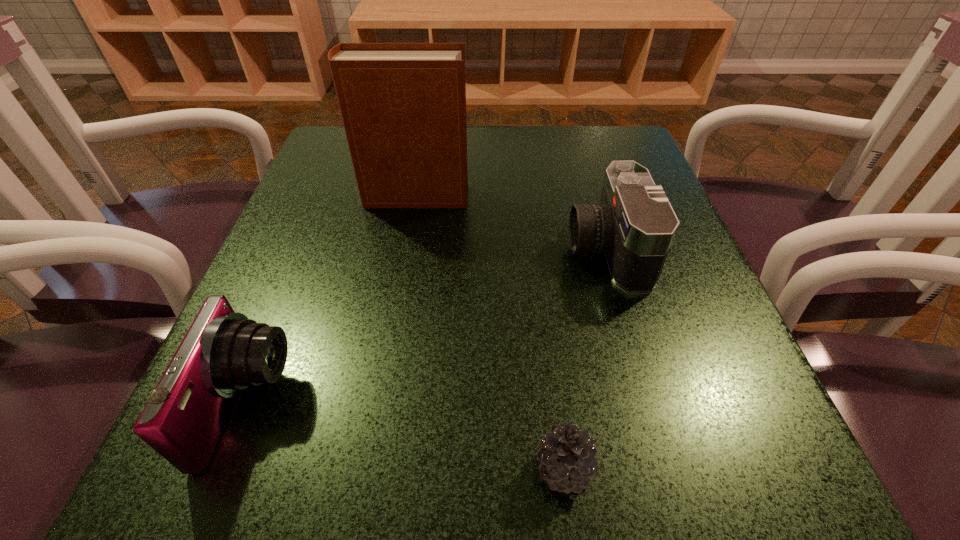
This screenshot has height=540, width=960. I want to click on free space located on the front-facing side of the right camera, so click(x=404, y=249).

Locate an element on the screen. free spot located 0.140m on the front-facing side of the right camera is located at coordinates pos(490,249).

I want to click on free spot located 0.260m on the front-facing side of the leftmost object, so click(483, 404).

I want to click on vacant space located 0.320m on the left of the shortest object, so click(x=260, y=470).

Locate an element on the screen. camera at the near edge is located at coordinates (223, 352).

This screenshot has height=540, width=960. What are the coordinates of `pinecone positioned at the near edge` in the screenshot? It's located at (567, 456).

This screenshot has height=540, width=960. I want to click on hardback book that is at the left edge, so click(403, 105).

Identify the location of camera present at the left edge. This screenshot has width=960, height=540. (223, 352).

What are the coordinates of `object that is at the right edge` in the screenshot? It's located at click(x=634, y=224).

This screenshot has height=540, width=960. Identify the location of object that is at the near left corner. (223, 352).